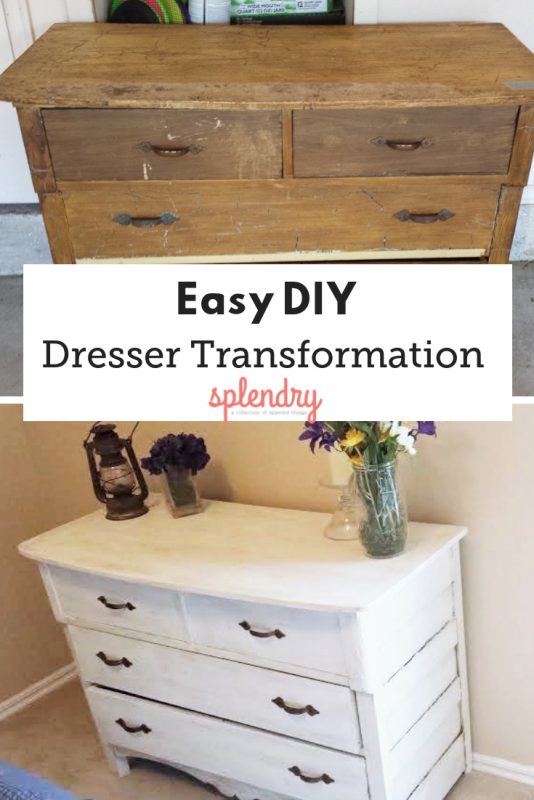
Where is `carpet`? carpet is located at coordinates (66, 742), (148, 786), (477, 788).